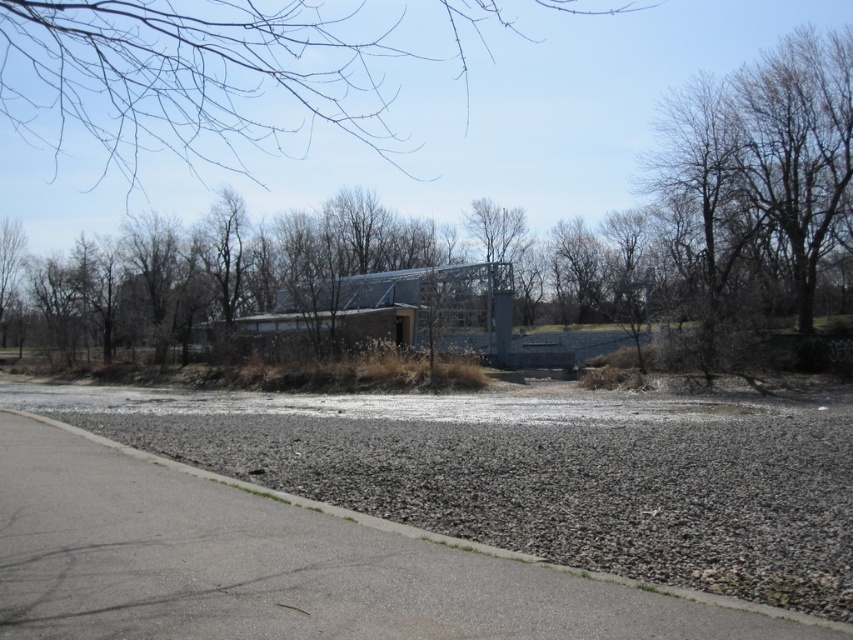
Question: Is gray gravel at lower right closer to camera compared to bare branches at upper center?

Choices:
 (A) no
 (B) yes

Answer: (B)

Question: Is brown leafless tree at center above gray gravel at lower right?

Choices:
 (A) yes
 (B) no

Answer: (A)

Question: Which object is the farthest from the brown leafless tree at center?

Choices:
 (A) gray gravel at lower right
 (B) bare branches at upper center

Answer: (A)

Question: Can you confirm if brown leafless tree at center is positioned to the right of bare branches at upper center?

Choices:
 (A) yes
 (B) no

Answer: (A)

Question: Which is nearer to the brown leafless tree at center?

Choices:
 (A) gray gravel at lower right
 (B) bare branches at upper center

Answer: (B)

Question: Which object is farther from the camera taking this photo?

Choices:
 (A) gray gravel at lower right
 (B) brown leafless tree at center
 (C) bare branches at upper center

Answer: (B)